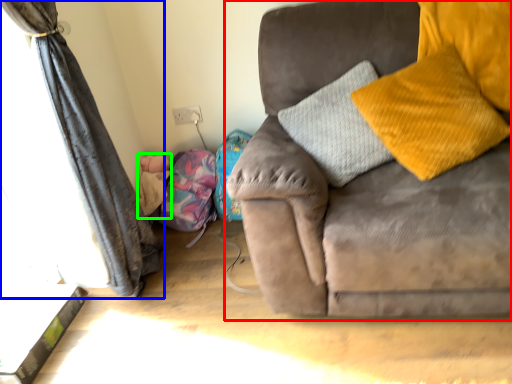
Question: Which object is positioned closest to studio couch (highlighted by a red box)? Select from curtain (highlighted by a blue box) and baby (highlighted by a green box).

Choices:
 (A) curtain
 (B) baby

Answer: (A)